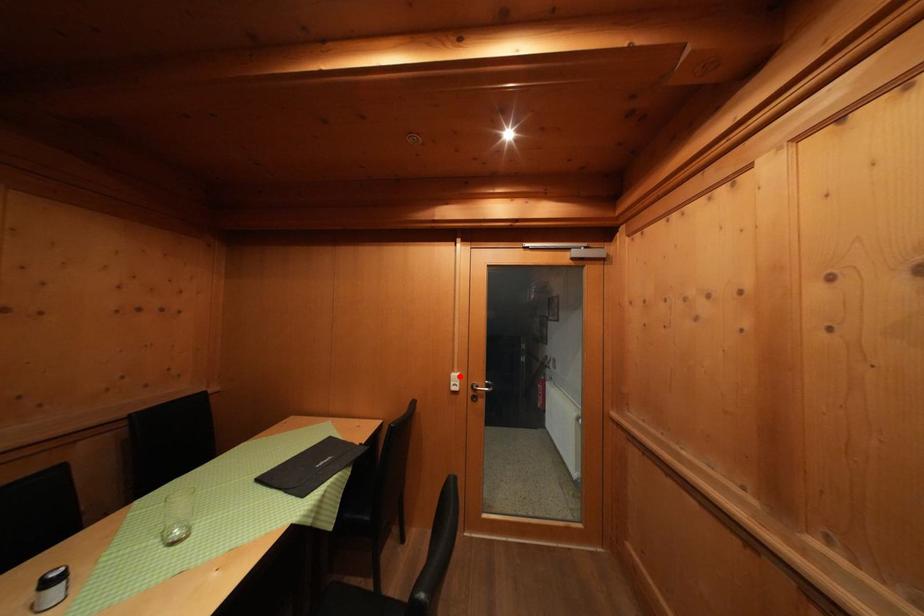
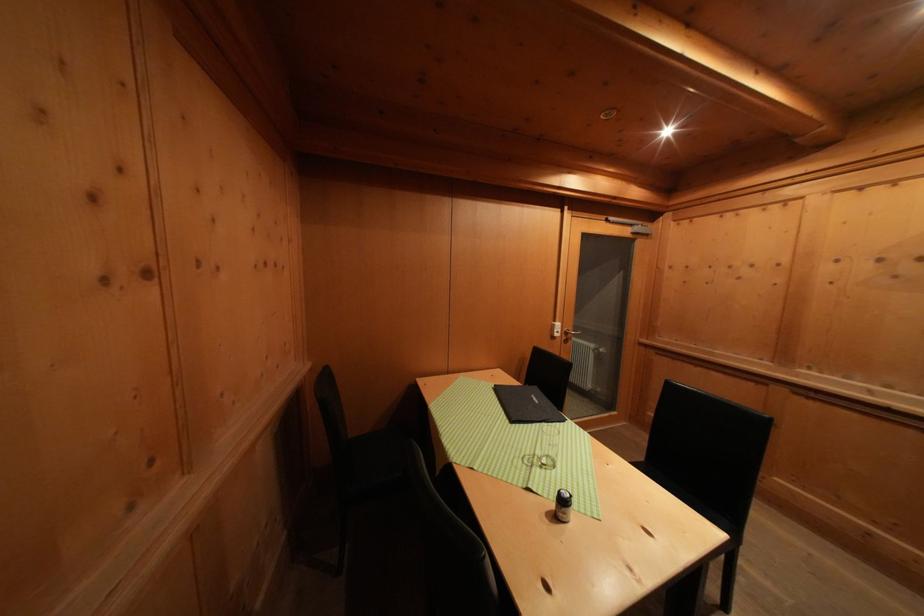
In the second image, find the point that corresponds to the highlighted location in the first image.

(561, 326)